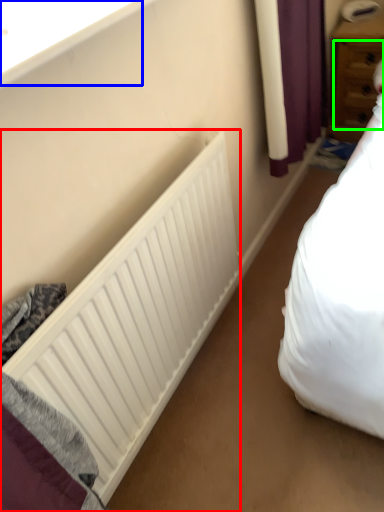
Question: Estimate the real-world distances between objects in this image. Which object is closer to radiator (highlighted by a red box), window sill (highlighted by a blue box) or drawer (highlighted by a green box)?

Choices:
 (A) window sill
 (B) drawer

Answer: (A)